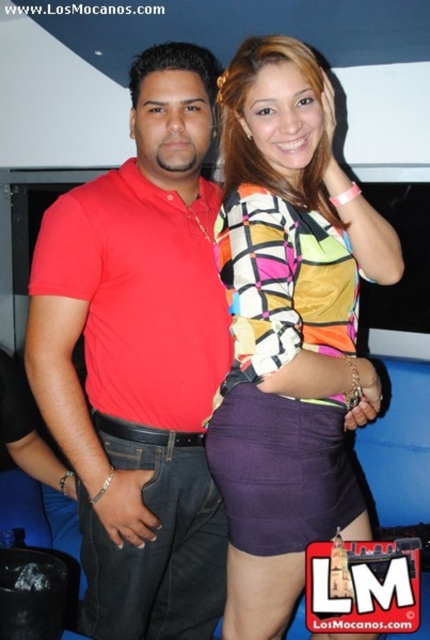
You are a photographer setting up for a group photo. You need to ensure that the matte red polo shirt at center and the purple satin skirt at center are visible in the frame. Given that your camera has a focal length of 50mm and a sensor size of 24x36mm, what is the minimum distance you should stand from the subjects to ensure both items are fully in focus?

The matte red polo shirt at center is 26.44 centimeters from the purple satin skirt at center. To ensure both are in focus, the photographer should maintain a distance greater than 2 meters from the subjects, as the depth of field at 50mm with a 24x36mm sensor can handle objects within 26.44 cm separation at that distance.

You are standing in a room and see the matte red polo shirt at center. If you want to reach it in 2 seconds, what is the minimum speed you need to move at?

The distance between the matte red polo shirt at center and the viewer is 3.95 feet. To cover this distance in 2 seconds, you would need to move at a minimum speed of approximately 1.975 feet per second.

You are standing in front of the image and want to describe the position of the matte red polo shirt at center. What are its coordinates?

The matte red polo shirt at center is located at point coordinates (141, 358).